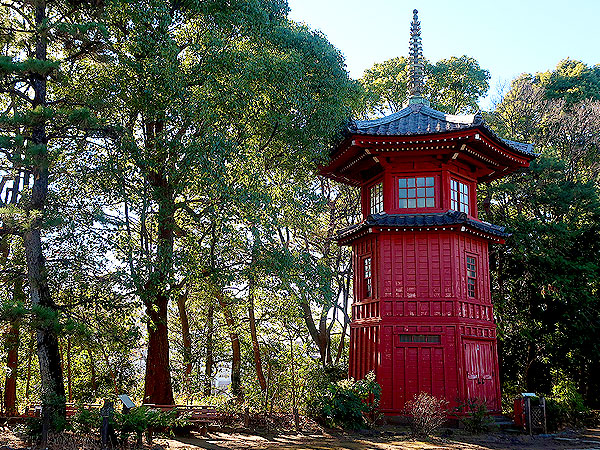
Where is `top window - left side`? The height and width of the screenshot is (450, 600). top window - left side is located at coordinates (370, 204).